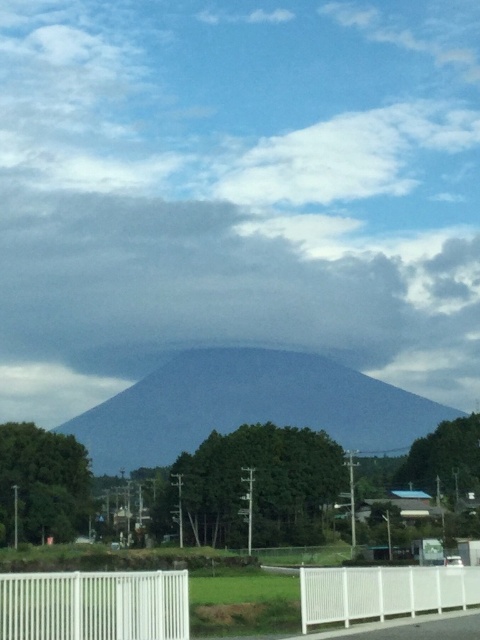
In the scene shown: Does white plastic fence at lower left appear over white plastic fence at lower right?

Indeed, white plastic fence at lower left is positioned over white plastic fence at lower right.

At what (x,y) coordinates should I click in order to perform the action: click on white plastic fence at lower left. Please return your answer as a coordinate pair (x, y). Looking at the image, I should click on (95, 605).

Is gray/cloudy sky at center above white plastic fence at lower left?

Indeed, gray/cloudy sky at center is positioned over white plastic fence at lower left.

Which is behind, point (12, 132) or point (51, 612)?

Positioned behind is point (12, 132).

Image resolution: width=480 pixels, height=640 pixels. What do you see at coordinates (237, 189) in the screenshot?
I see `gray/cloudy sky at center` at bounding box center [237, 189].

Find the location of a particular element. The height and width of the screenshot is (640, 480). gray/cloudy sky at center is located at coordinates (237, 189).

Is blue matte mountain at center in front of white plastic fence at lower left?

No, it is behind white plastic fence at lower left.

Can you confirm if blue matte mountain at center is wider than white plastic fence at lower left?

Yes, blue matte mountain at center is wider than white plastic fence at lower left.

Between point (397, 404) and point (139, 600), which one is positioned in front?

Point (139, 600)

The width and height of the screenshot is (480, 640). I want to click on blue matte mountain at center, so click(x=249, y=406).